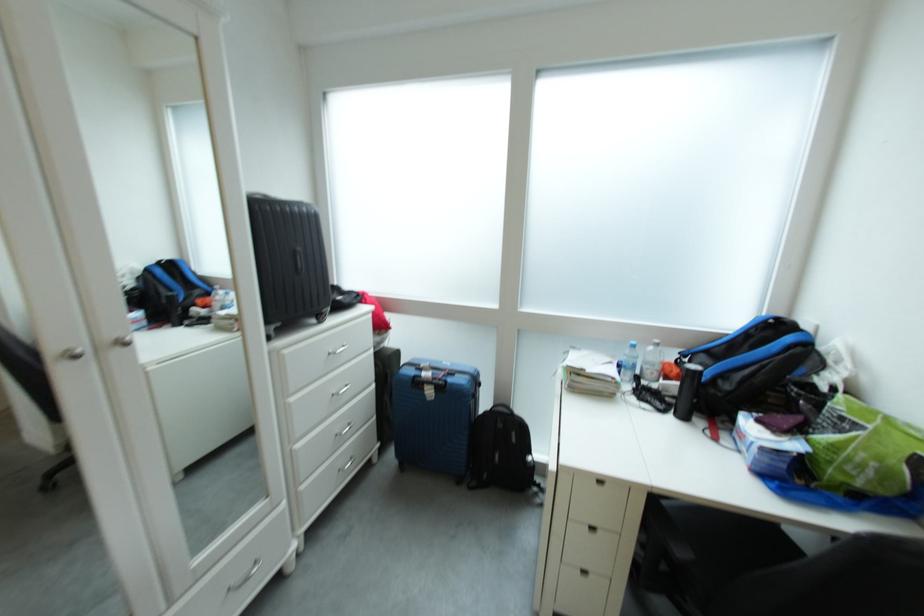
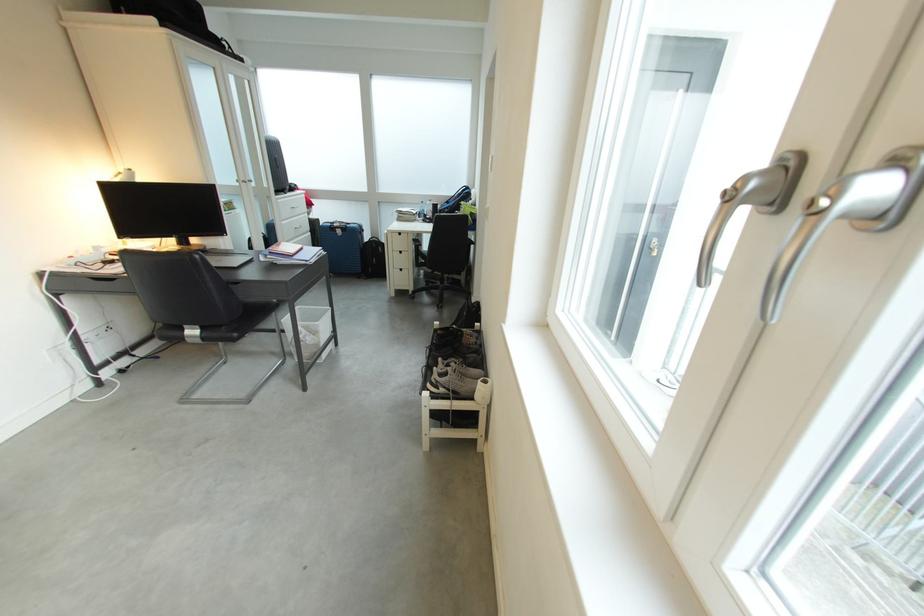
In the second image, find the point that corresponds to [496,406] in the first image.

(379, 243)